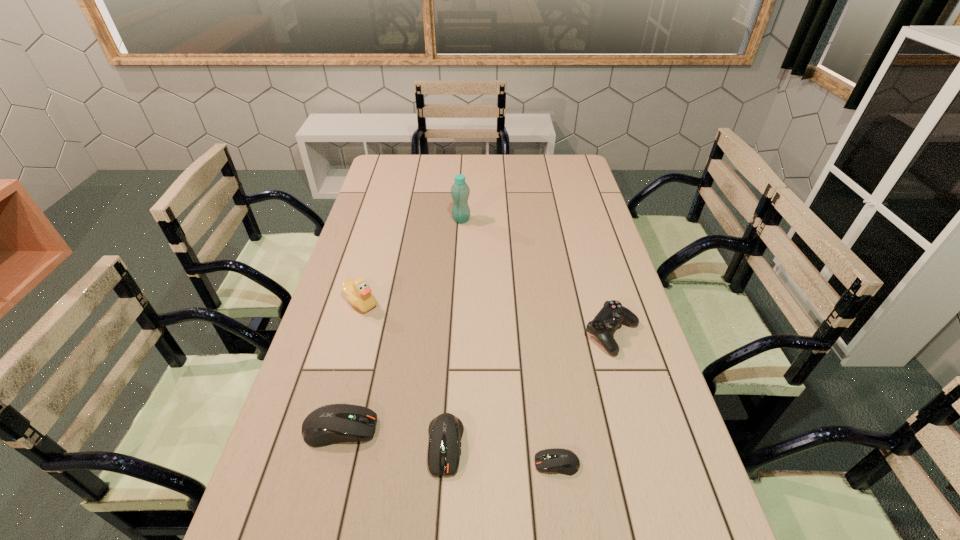
The width and height of the screenshot is (960, 540). I want to click on object situated at the right edge, so click(605, 323).

This screenshot has height=540, width=960. In order to click on vacant space at the far edge of the desktop in this screenshot , I will do `click(485, 156)`.

The image size is (960, 540). Identify the location of vacant area at the left edge. (346, 359).

Identify the location of free location at the right edge of the desktop. (620, 288).

Identify the location of vacant point at the near right corner. This screenshot has height=540, width=960. pyautogui.click(x=676, y=520).

Find the location of a particular element. Image resolution: width=960 pixels, height=540 pixels. vacant space that's between the tallest object and the leftmost computer equipment is located at coordinates (400, 324).

Where is `free space between the shortest object and the second computer equipment from left to right`? The height and width of the screenshot is (540, 960). free space between the shortest object and the second computer equipment from left to right is located at coordinates (501, 454).

Identify the location of empty space between the water bottle and the control. (537, 277).

At what (x,y) coordinates should I click in order to perform the action: click on free space between the duck and the control. Please return your answer as a coordinate pair (x, y). This screenshot has width=960, height=540. Looking at the image, I should click on (487, 318).

The image size is (960, 540). What are the coordinates of `vacant region between the second tallest computer equipment and the second tallest object` in the screenshot? It's located at (403, 374).